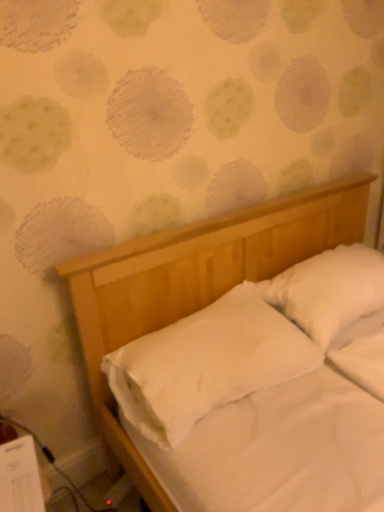
Question: From the image's perspective, is white soft pillow at upper right, the first pillow viewed from the right, located above or below white smooth pillow at center, the first pillow in the left-to-right sequence?

Choices:
 (A) below
 (B) above

Answer: (B)

Question: From a real-world perspective, relative to white smooth pillow at center, the first pillow in the left-to-right sequence, is white soft pillow at upper right, placed as the 2th pillow when sorted from left to right, vertically above or below?

Choices:
 (A) above
 (B) below

Answer: (A)

Question: Is white soft pillow at upper right, placed as the 2th pillow when sorted from left to right, inside the boundaries of white smooth pillow at center, the first pillow in the left-to-right sequence, or outside?

Choices:
 (A) inside
 (B) outside

Answer: (B)

Question: Considering the positions of white smooth pillow at center, the first pillow in the left-to-right sequence, and white soft pillow at upper right, the first pillow viewed from the right, in the image, is white smooth pillow at center, the first pillow in the left-to-right sequence, wider or thinner than white soft pillow at upper right, the first pillow viewed from the right,?

Choices:
 (A) wide
 (B) thin

Answer: (A)

Question: Is point (157, 436) positioned closer to the camera than point (364, 316)?

Choices:
 (A) farther
 (B) closer

Answer: (B)

Question: Considering the relative positions of white smooth pillow at center, which is counted as the second pillow, starting from the right, and white soft pillow at upper right, the first pillow viewed from the right, in the image provided, is white smooth pillow at center, which is counted as the second pillow, starting from the right, to the left or to the right of white soft pillow at upper right, the first pillow viewed from the right,?

Choices:
 (A) left
 (B) right

Answer: (A)

Question: Do you think white smooth pillow at center, which is counted as the second pillow, starting from the right, is within white soft pillow at upper right, the first pillow viewed from the right, or outside of it?

Choices:
 (A) outside
 (B) inside

Answer: (A)